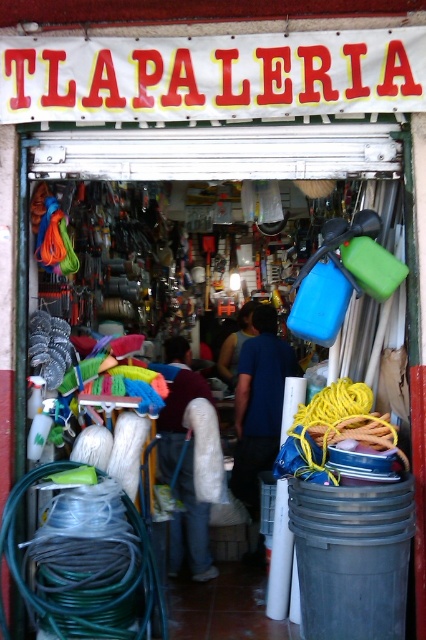
Which of these two, blue fabric at center or maroon fabric at center, stands shorter?

maroon fabric at center is shorter.

Does blue fabric at center have a smaller size compared to maroon fabric at center?

Correct, blue fabric at center occupies less space than maroon fabric at center.

Who is more distant from viewer, (235, 458) or (172, 448)?

The point (235, 458) is more distant.

You are a GUI agent. You are given a task and a screenshot of the screen. Output one action in this format:
    pyautogui.click(x=<x>, y=<y>)
    Task: Click on the blue fabric at center
    This screenshot has width=426, height=640.
    Given the screenshot: What is the action you would take?
    pyautogui.click(x=259, y=404)

Between maroon fabric at center and blue fabric shirt at center, which one is positioned higher?

Positioned higher is blue fabric shirt at center.

Does maroon fabric at center appear on the left side of blue fabric shirt at center?

Indeed, maroon fabric at center is positioned on the left side of blue fabric shirt at center.

Where is `maroon fabric at center`? The width and height of the screenshot is (426, 640). maroon fabric at center is located at coordinates (176, 403).

Identify the location of maroon fabric at center. (176, 403).

Between point (66, 545) and point (198, 540), which one is positioned in front?

Point (66, 545)

Locate an element on the screen. green rubber hose at lower left is located at coordinates (85, 570).

Identify the location of green rubber hose at lower left. (85, 570).

You are a GUI agent. You are given a task and a screenshot of the screen. Output one action in this format:
    pyautogui.click(x=<x>, y=<y>)
    Task: Click on the green rubber hose at lower left
    This screenshot has width=426, height=640.
    Given the screenshot: What is the action you would take?
    pyautogui.click(x=85, y=570)